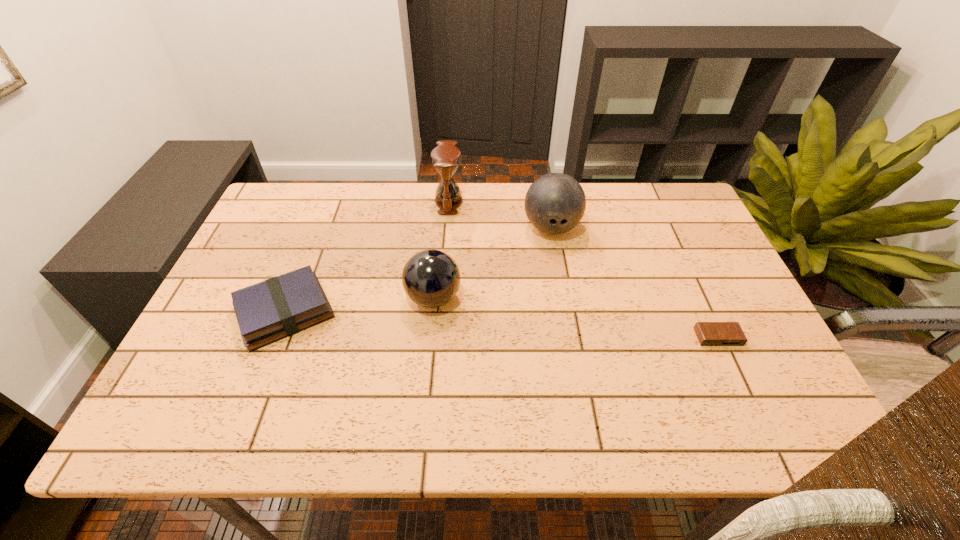
Where is `free spot between the nearer bowling ball and the hourglass`? free spot between the nearer bowling ball and the hourglass is located at coordinates (441, 250).

This screenshot has width=960, height=540. I want to click on vacant area that lies between the nearer bowling ball and the leftmost object, so [359, 305].

Find the location of a particular element. The height and width of the screenshot is (540, 960). free space between the third shortest object and the fourth tallest object is located at coordinates (359, 305).

Where is `vacant area that lies between the hourglass and the leftmost object`? vacant area that lies between the hourglass and the leftmost object is located at coordinates (367, 257).

Identify which object is located as the nearest to the farther bowling ball. Please provide its 2D coordinates. Your answer should be formatted as a tuple, i.e. [(x, y)], where the tuple contains the x and y coordinates of a point satisfying the conditions above.

[(445, 157)]

Image resolution: width=960 pixels, height=540 pixels. Find the location of `the fourth closest object relative to the rightmost object`. the fourth closest object relative to the rightmost object is located at coordinates (279, 307).

Identify the location of free spot that satisfies the following two spatial constraints: 1. on the front side of the hourglass; 2. on the side of the nearer bowling ball with the finger holes. (441, 298).